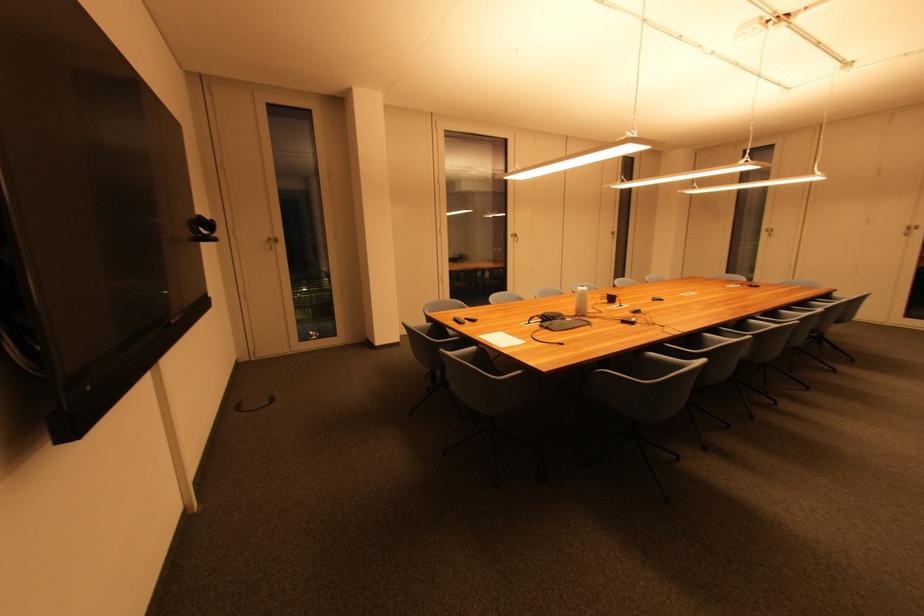
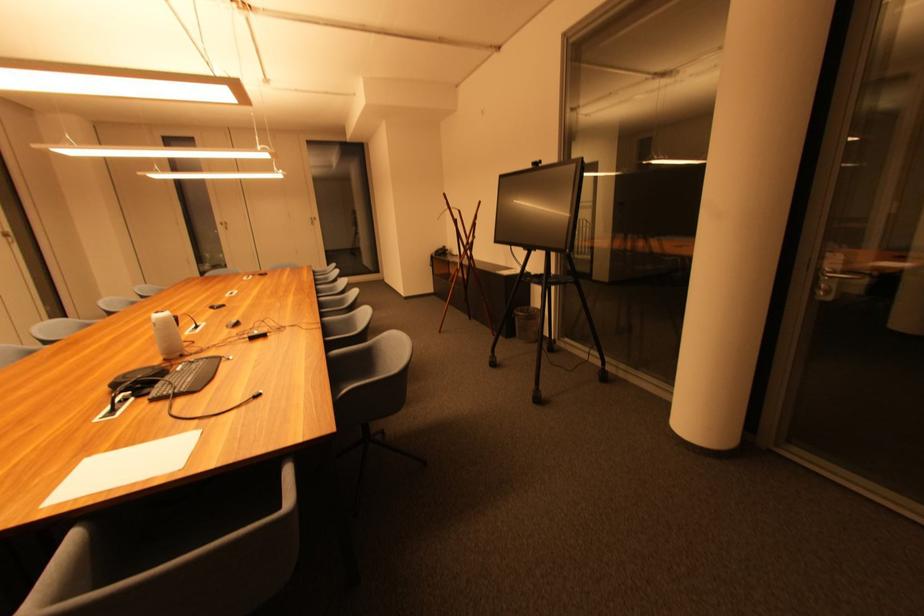
Locate, in the second image, the point that corresponds to (532,323) in the first image.

(114, 411)